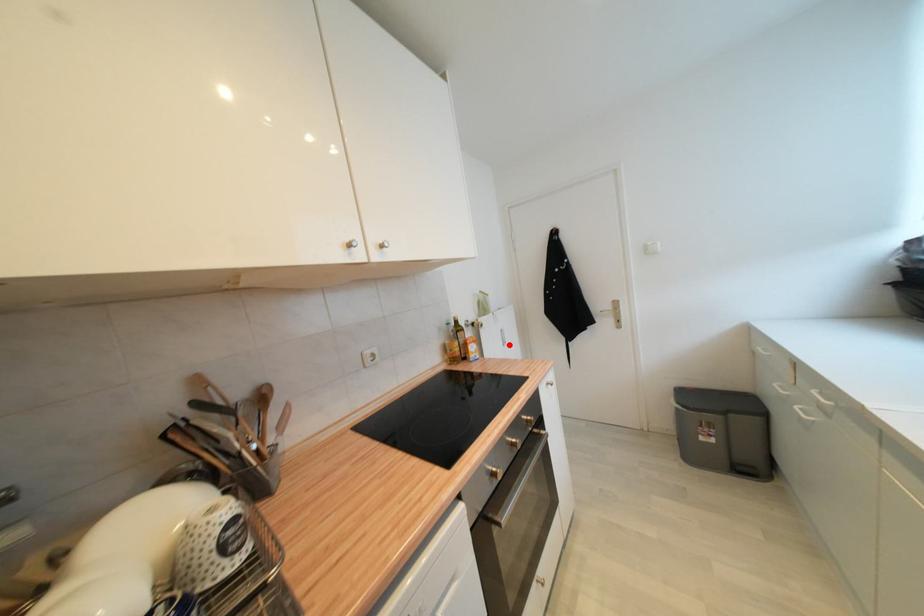
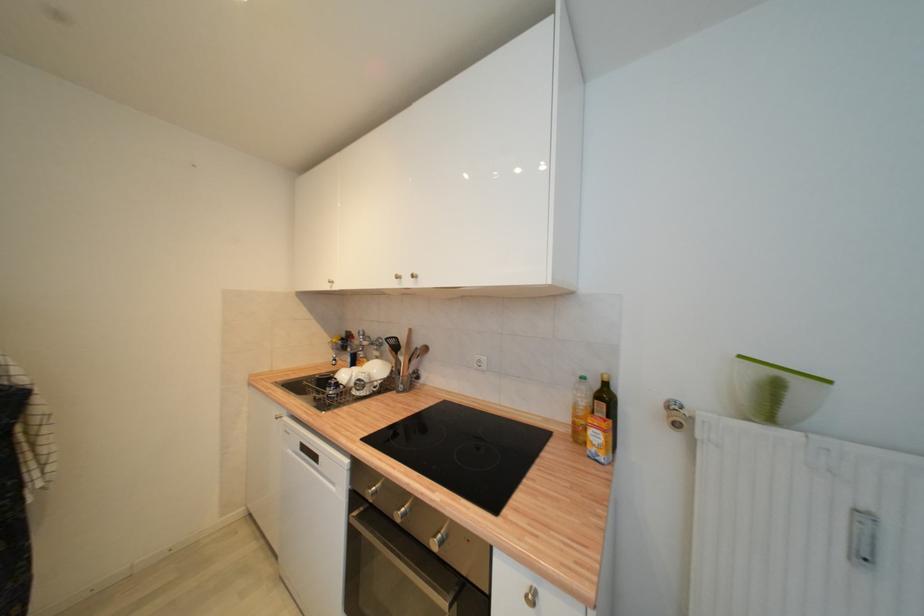
In the second image, find the point that corresponds to the highlighted location in the first image.

(869, 560)